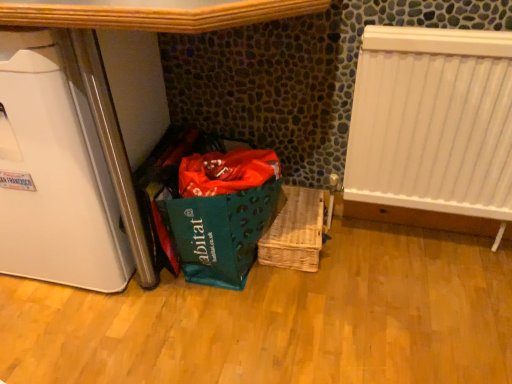
Identify the location of blank space above white plastic radiator at right (from a real-world perspective). (435, 19).